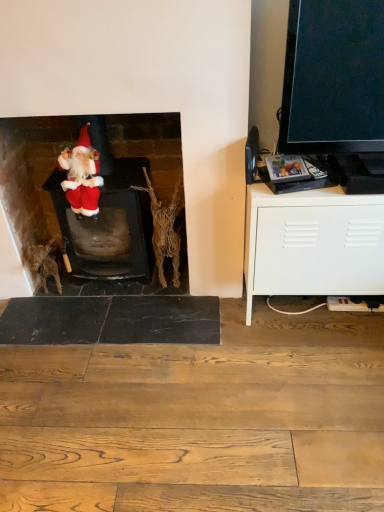
In order to face fuzzy fabric santa at left, should I rotate leftwards or rightwards?

To face it directly, rotate left by 14.810 degrees.

What do you see at coordinates (31, 172) in the screenshot? This screenshot has width=384, height=512. I see `velvet santa at left` at bounding box center [31, 172].

The height and width of the screenshot is (512, 384). Find the location of `fuzzy fabric santa at left`. fuzzy fabric santa at left is located at coordinates (82, 175).

Is white matte cabinet at right not within fuzzy fabric santa at left?

Yes, white matte cabinet at right is not within fuzzy fabric santa at left.

The height and width of the screenshot is (512, 384). What are the coordinates of `cabinetry on the right of fuzzy fabric santa at left` in the screenshot? It's located at (312, 243).

Is white matte cabinet at right closer to camera compared to fuzzy fabric santa at left?

Yes, white matte cabinet at right is closer to the camera.

Considering the sizes of objects fuzzy fabric santa at left and velvet santa at left in the image provided, who is bigger, fuzzy fabric santa at left or velvet santa at left?

velvet santa at left is bigger.

Does fuzzy fabric santa at left have a greater height compared to velvet santa at left?

No.

Can you tell me how much fuzzy fabric santa at left and velvet santa at left differ in facing direction?

The facing directions of fuzzy fabric santa at left and velvet santa at left are 2.26 degrees apart.

Is fuzzy fabric santa at left placed right next to velvet santa at left?

They are not placed beside each other.

Which is correct: white matte cabinet at right is inside velvet santa at left, or outside of it?

white matte cabinet at right lies outside velvet santa at left.

Which object is positioned more to the left, white matte cabinet at right or velvet santa at left?

velvet santa at left is more to the left.

Find the location of a particular element. The height and width of the screenshot is (512, 384). fireplace located above the white matte cabinet at right (from a real-world perspective) is located at coordinates (31, 172).

Is point (357, 239) closer or farther from the camera than point (35, 145)?

Clearly, point (357, 239) is closer to the camera than point (35, 145).

Do you think velvet santa at left is within fuzzy fabric santa at left, or outside of it?

velvet santa at left is not enclosed by fuzzy fabric santa at left.

From the image's perspective, does velvet santa at left appear higher than fuzzy fabric santa at left?

No, from the image's perspective, velvet santa at left is not over fuzzy fabric santa at left.

Is velvet santa at left next to fuzzy fabric santa at left and touching it?

No, velvet santa at left is not with fuzzy fabric santa at left.

Does velvet santa at left lie in front of white matte cabinet at right?

No, velvet santa at left is further to the viewer.

Is velvet santa at left looking in the opposite direction of white matte cabinet at right?

No, velvet santa at left is not facing away from white matte cabinet at right.

Is velvet santa at left far from white matte cabinet at right?

velvet santa at left is near white matte cabinet at right, not far away.

Can you confirm if velvet santa at left is wider than white matte cabinet at right?

In fact, velvet santa at left might be narrower than white matte cabinet at right.

Considering the positions of point (70, 201) and point (338, 276), is point (70, 201) closer or farther from the camera than point (338, 276)?

Point (70, 201) is farther from the camera than point (338, 276).

Is fuzzy fabric santa at left not near white matte cabinet at right?

No.

From the image's perspective, is fuzzy fabric santa at left located above or below white matte cabinet at right?

From the image's perspective, fuzzy fabric santa at left appears above white matte cabinet at right.

This screenshot has width=384, height=512. I want to click on cabinetry on the right of fuzzy fabric santa at left, so click(312, 243).

Where is `person on the left side of velvet santa at left`? person on the left side of velvet santa at left is located at coordinates (82, 175).

Considering their positions, is white matte cabinet at right positioned further to fuzzy fabric santa at left than velvet santa at left?

white matte cabinet at right is further to fuzzy fabric santa at left.

When comparing their distances from white matte cabinet at right, does fuzzy fabric santa at left or velvet santa at left seem further?

fuzzy fabric santa at left.

From the image, which object appears to be farther from white matte cabinet at right, velvet santa at left or fuzzy fabric santa at left?

fuzzy fabric santa at left.

In the scene shown: When comparing their distances from velvet santa at left, does fuzzy fabric santa at left or white matte cabinet at right seem closer?

The object closer to velvet santa at left is fuzzy fabric santa at left.

From the image, which object appears to be farther from velvet santa at left, white matte cabinet at right or fuzzy fabric santa at left?

white matte cabinet at right lies further to velvet santa at left than the other object.

Based on the photo, based on their spatial positions, is velvet santa at left or white matte cabinet at right closer to fuzzy fabric santa at left?

The object closer to fuzzy fabric santa at left is velvet santa at left.

Where is `fireplace situated between fuzzy fabric santa at left and white matte cabinet at right from left to right`? The width and height of the screenshot is (384, 512). fireplace situated between fuzzy fabric santa at left and white matte cabinet at right from left to right is located at coordinates (31, 172).